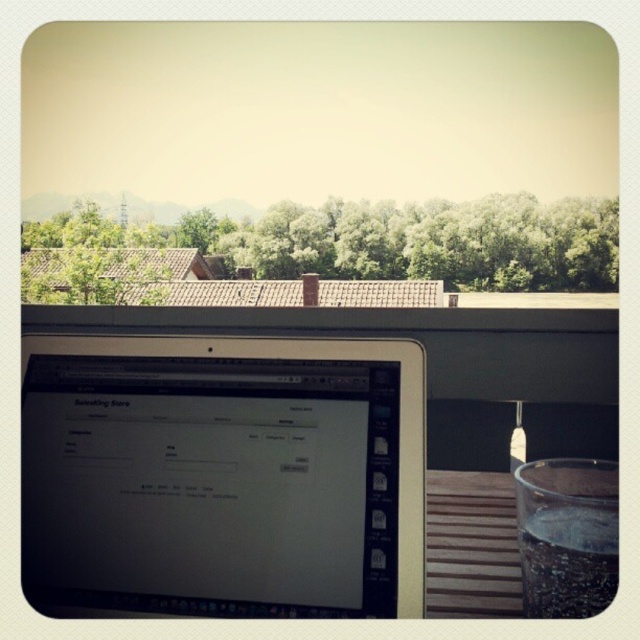
You are a remote worker on a balcony. You need to place a document on the desk between the satin black laptop at center and the clear glass at lower right. Is there enough space for the document?

The clear glass at lower right is behind the satin black laptop at center, so there is enough space between them to place the document on the desk.

You are organizing items on a balcony table. You have a satin black laptop at center and a clear glass at lower right. According to the scene, which object is positioned to the right side of the other?

The clear glass at lower right is positioned to the right of the satin black laptop at center.

You are a remote worker trying to access your laptop. You are standing at the entrance of the balcony. According to the image, where is the satin black laptop at center located relative to your position?

The satin black laptop at center is located at point (x=221, y=476) in the image, so it is positioned to your right and slightly forward from the entrance of the balcony.